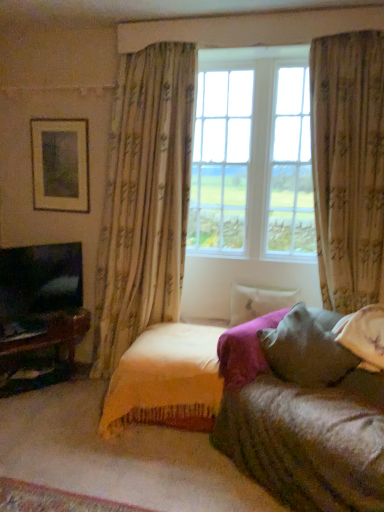
Question: Is floral fabric curtain at center, which is the first curtain from left to right, to the right of matte black tv at left from the viewer's perspective?

Choices:
 (A) no
 (B) yes

Answer: (B)

Question: Does floral fabric curtain at center, which is the first curtain from left to right, have a lesser width compared to matte black tv at left?

Choices:
 (A) yes
 (B) no

Answer: (B)

Question: From the image's perspective, does floral fabric curtain at center, which is the first curtain from left to right, appear lower than matte black tv at left?

Choices:
 (A) no
 (B) yes

Answer: (A)

Question: Is floral fabric curtain at center, which is the first curtain from left to right, smaller than matte black tv at left?

Choices:
 (A) no
 (B) yes

Answer: (A)

Question: From the image's perspective, does floral fabric curtain at center, the second curtain positioned from the right, appear higher than matte black tv at left?

Choices:
 (A) no
 (B) yes

Answer: (B)

Question: Is white soft pillow at center, positioned as the first pillow in back-to-front order, situated inside matte gold picture frame at upper left or outside?

Choices:
 (A) outside
 (B) inside

Answer: (A)

Question: Looking at the image, does white soft pillow at center, the 2th pillow from the front, seem bigger or smaller compared to matte gold picture frame at upper left?

Choices:
 (A) small
 (B) big

Answer: (B)

Question: Does point (284, 305) appear closer or farther from the camera than point (46, 124)?

Choices:
 (A) farther
 (B) closer

Answer: (B)

Question: In terms of width, does white soft pillow at center, the 2th pillow from the front, look wider or thinner when compared to matte gold picture frame at upper left?

Choices:
 (A) thin
 (B) wide

Answer: (B)

Question: Considering the positions of velvet yellow blanket at center and matte gold picture frame at upper left in the image, is velvet yellow blanket at center taller or shorter than matte gold picture frame at upper left?

Choices:
 (A) tall
 (B) short

Answer: (B)

Question: Considering the positions of point [104, 397] and point [34, 178], is point [104, 397] closer or farther from the camera than point [34, 178]?

Choices:
 (A) closer
 (B) farther

Answer: (A)

Question: Considering the positions of velvet yellow blanket at center and matte gold picture frame at upper left in the image, is velvet yellow blanket at center bigger or smaller than matte gold picture frame at upper left?

Choices:
 (A) big
 (B) small

Answer: (A)

Question: Do you think velvet yellow blanket at center is within matte gold picture frame at upper left, or outside of it?

Choices:
 (A) outside
 (B) inside

Answer: (A)

Question: Would you say textured beige curtain at right, acting as the first curtain starting from the right, is to the left or to the right of floral fabric curtain at center, the second curtain positioned from the right, in the picture?

Choices:
 (A) right
 (B) left

Answer: (A)

Question: Is textured beige curtain at right, acting as the 2th curtain starting from the left, taller or shorter than floral fabric curtain at center, which is the first curtain from left to right?

Choices:
 (A) short
 (B) tall

Answer: (B)